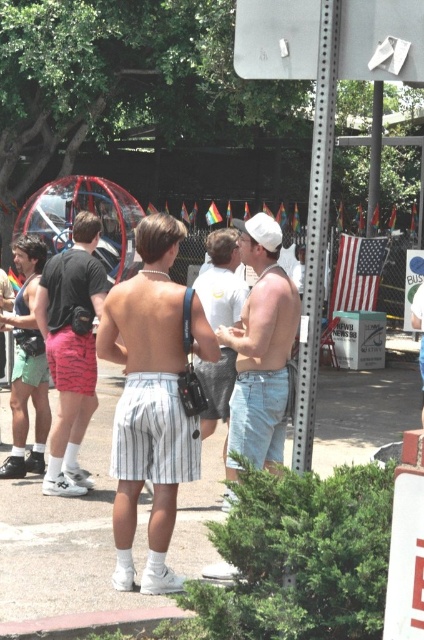
You are standing in the outdoor event and want to take a photo of the white striped shorts at center and the white cotton shirt at center. Which one should you focus on first to ensure both are in focus?

You should focus on the white striped shorts at center first because it is closer to the viewer than the white cotton shirt at center, so adjusting focus from near to far will help both be in focus.

In the scene shown: You are standing in the outdoor event scene and need to move from the point closer to you to the farther point. Which path would you take between the two points, point (159, 568) and point (226, 301)?

You should move from point (159, 568) to point (226, 301) since point (159, 568) is closer to the viewer and you need to go to the farther point.

You are standing at the entrance of the Ferris wheel and want to find the person wearing the matte white shorts at center. Based on the coordinates provided, in which direction should you look relative to your current position?

The matte white shorts at center is located at coordinates point (261, 349), which is slightly to the right and above your current position at the entrance of the Ferris wheel.